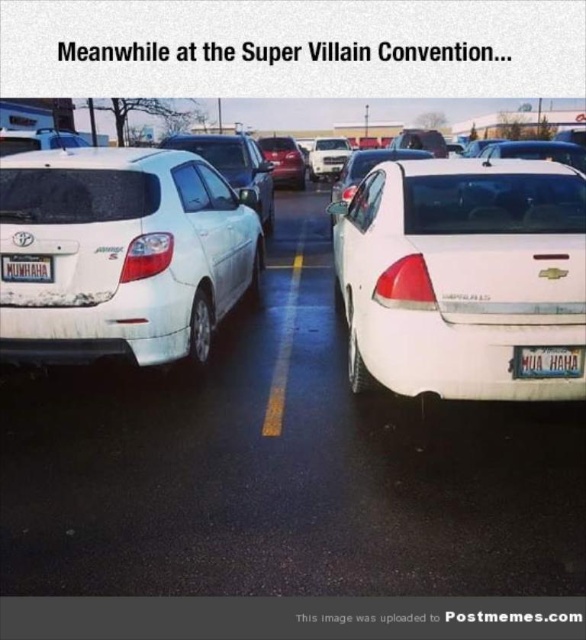
You are a delivery driver who needs to park your van between the white matte hatchback at left and the shiny red car at center. Your van is 6 meters long. Can you fit your van between them?

The white matte hatchback at left and shiny red car at center are 7.05 meters apart. Since your van is 6 meters long, there is enough space to park between them as 6 meters is less than 7.05 meters.

You are a delivery person trying to load a tall package into your truck. You see a satin silver sedan at center and a shiny red car at center in the parking lot. Which car has more vertical space between its roof and the ground, allowing the package to fit better?

The satin silver sedan at center has a greater height compared to the shiny red car at center, so it has more vertical space between its roof and the ground, allowing the package to fit better.